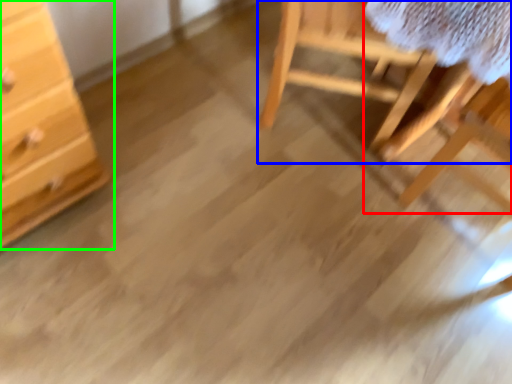
Question: Considering the real-world distances, which object is closest to table (highlighted by a red box)? furniture (highlighted by a blue box) or chest of drawers (highlighted by a green box).

Choices:
 (A) furniture
 (B) chest of drawers

Answer: (A)